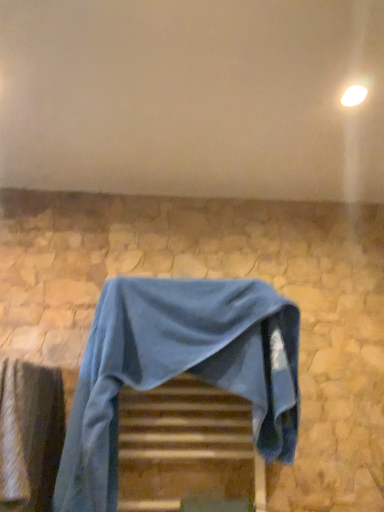
Question: Does wooden at center have a greater height compared to blue fabric-covered chair at center?

Choices:
 (A) yes
 (B) no

Answer: (B)

Question: Is the position of wooden at center less distant than that of blue fabric-covered chair at center?

Choices:
 (A) no
 (B) yes

Answer: (A)

Question: Can you confirm if wooden at center is positioned to the right of blue fabric-covered chair at center?

Choices:
 (A) yes
 (B) no

Answer: (A)

Question: Is wooden at center not within blue fabric-covered chair at center?

Choices:
 (A) no
 (B) yes

Answer: (B)

Question: Would you say wooden at center contains blue fabric-covered chair at center?

Choices:
 (A) yes
 (B) no

Answer: (B)

Question: Is smooth stone wall at upper center wider or thinner than blue fabric at lower left?

Choices:
 (A) wide
 (B) thin

Answer: (A)

Question: Considering the relative positions of smooth stone wall at upper center and blue fabric at lower left in the image provided, is smooth stone wall at upper center to the left or to the right of blue fabric at lower left?

Choices:
 (A) right
 (B) left

Answer: (A)

Question: From the image's perspective, relative to blue fabric at lower left, is smooth stone wall at upper center above or below?

Choices:
 (A) below
 (B) above

Answer: (B)

Question: Which is correct: smooth stone wall at upper center is inside blue fabric at lower left, or outside of it?

Choices:
 (A) inside
 (B) outside

Answer: (B)

Question: From a real-world perspective, relative to blue fabric at lower left, is wooden at center vertically above or below?

Choices:
 (A) below
 (B) above

Answer: (A)

Question: Visually, is wooden at center positioned to the left or to the right of blue fabric at lower left?

Choices:
 (A) right
 (B) left

Answer: (A)

Question: From the image's perspective, relative to blue fabric at lower left, is wooden at center above or below?

Choices:
 (A) above
 (B) below

Answer: (B)

Question: Considering the positions of point (122, 394) and point (26, 435), is point (122, 394) closer or farther from the camera than point (26, 435)?

Choices:
 (A) farther
 (B) closer

Answer: (A)

Question: Is point (62, 421) positioned closer to the camera than point (51, 95)?

Choices:
 (A) closer
 (B) farther

Answer: (B)

Question: Based on their positions, is blue fabric at lower left located to the left or right of smooth stone wall at upper center?

Choices:
 (A) right
 (B) left

Answer: (B)